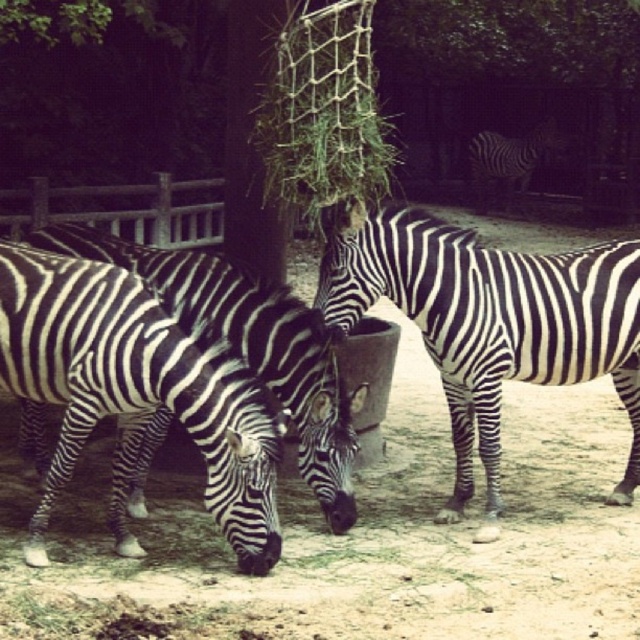
Question: Where is black and white striped zebra at lower left located in relation to black and white stripes at center in the image?

Choices:
 (A) below
 (B) above

Answer: (A)

Question: Can you confirm if black and white striped zebra at lower left is wider than black and white striped zebra at center?

Choices:
 (A) no
 (B) yes

Answer: (A)

Question: Which point is farther from the camera taking this photo?

Choices:
 (A) (138, 333)
 (B) (504, 180)

Answer: (B)

Question: Among these objects, which one is farthest from the camera?

Choices:
 (A) black and white stripes at center
 (B) black and white striped zebra at center
 (C) black and white striped zebra at lower left

Answer: (A)

Question: Estimate the real-world distances between objects in this image. Which object is farther from the black and white striped zebra at center?

Choices:
 (A) black and white striped zebra at lower left
 (B) black and white stripes at center

Answer: (B)

Question: In this image, where is black and white striped zebra at lower left located relative to black and white striped zebra at center?

Choices:
 (A) below
 (B) above

Answer: (A)